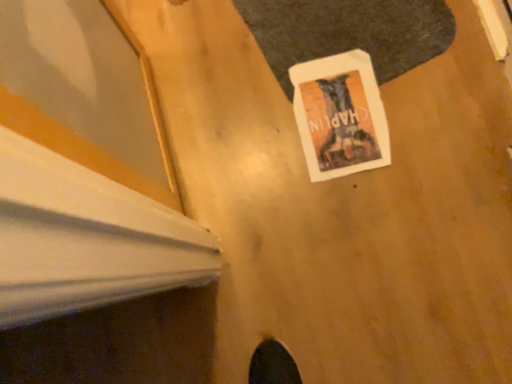
The width and height of the screenshot is (512, 384). What are the coordinates of `vacant area that lies between white paper at center and white paper at center` in the screenshot? It's located at (387, 100).